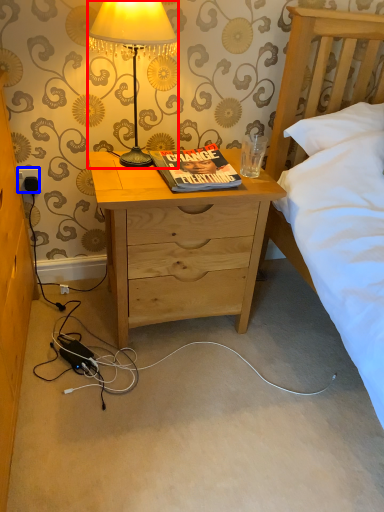
Question: Which object is further to the camera taking this photo, lamp (highlighted by a red box) or power outlet (highlighted by a blue box)?

Choices:
 (A) lamp
 (B) power outlet

Answer: (B)